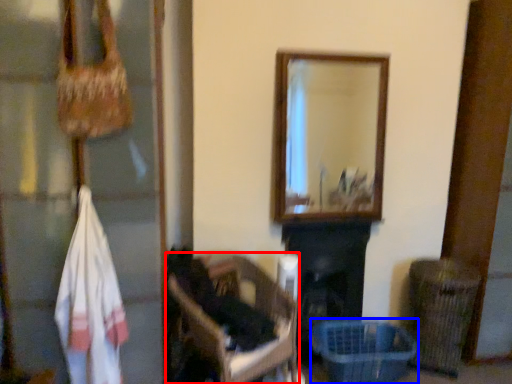
Question: Among these objects, which one is farthest to the camera, furniture (highlighted by a red box) or basket (highlighted by a blue box)?

Choices:
 (A) furniture
 (B) basket

Answer: (B)